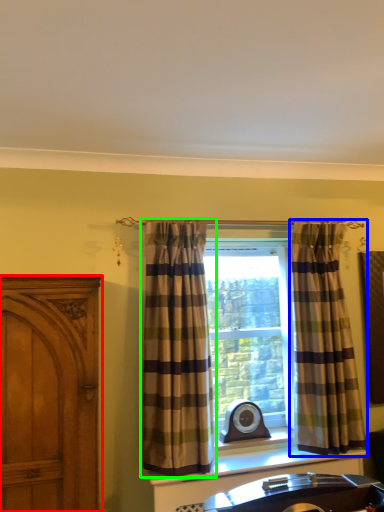
Question: Which object is positioned farthest from cabinetry (highlighted by a red box)? Select from curtain (highlighted by a blue box) and curtain (highlighted by a green box).

Choices:
 (A) curtain
 (B) curtain

Answer: (A)